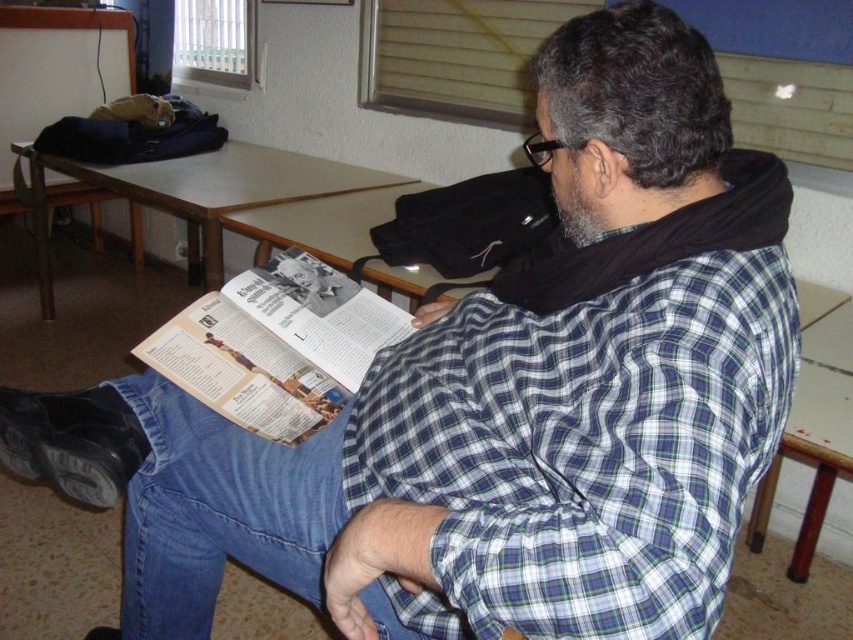
You are standing in the room and want to move from the green and white checkered shirt at center to the wooden chair at lower right. Which direction should you move to reach the chair?

The green and white checkered shirt at center is to the left of the wooden chair at lower right, so you should move to the right to reach the wooden chair at lower right.

You are a photographer trying to capture the man in the scene. You want to ensure that both the green and white checkered shirt at center and the printed paper magazine at center are clearly visible in your photo. Given their sizes, which object should you focus on first to ensure both are in focus?

The green and white checkered shirt at center has a greater height compared to the printed paper magazine at center, so focusing on the larger object first will help ensure both are in focus.